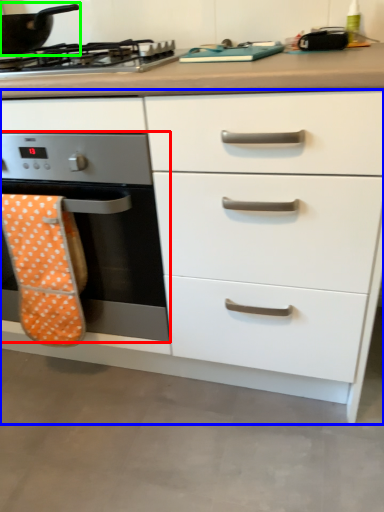
Question: Based on their relative distances, which object is nearer to home appliance (highlighted by a red box)? Choose from chest of drawers (highlighted by a blue box) and kitchen appliance (highlighted by a green box).

Choices:
 (A) chest of drawers
 (B) kitchen appliance

Answer: (A)